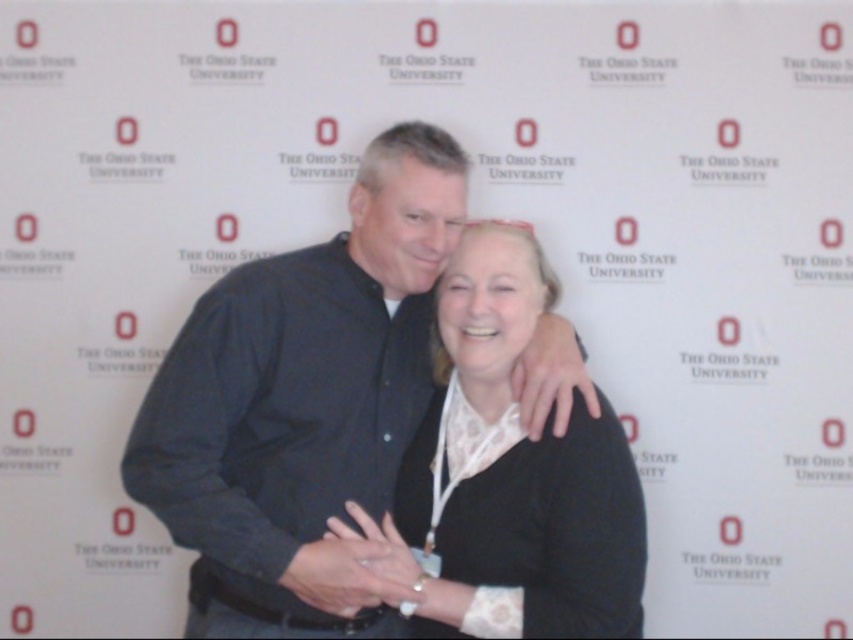
You are designing a poster for an event and need to ensure that the black matte shirt at center and the black matte sweater at center are clearly visible. Given their sizes, which one should you place closer to the front to make both visible?

The black matte shirt at center is much taller than the black matte sweater at center, so placing the black matte sweater at center closer to the front would ensure both are visible.

In the scene shown: You are a photographer trying to focus on the black matte shirt at center and the black matte sweater at center in the image. Which one should you adjust your camera focus to first if you want to capture both clearly?

The black matte shirt at center is closer to the viewer than the black matte sweater at center, so you should focus on the black matte shirt at center first to ensure both are in focus.